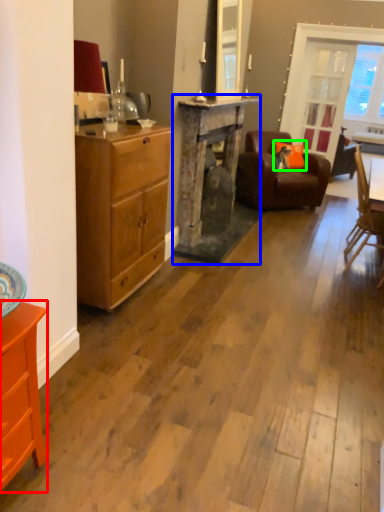
Question: Considering the real-world distances, which object is closest to cabinetry (highlighted by a red box)? fireplace (highlighted by a blue box) or pillow (highlighted by a green box).

Choices:
 (A) fireplace
 (B) pillow

Answer: (A)